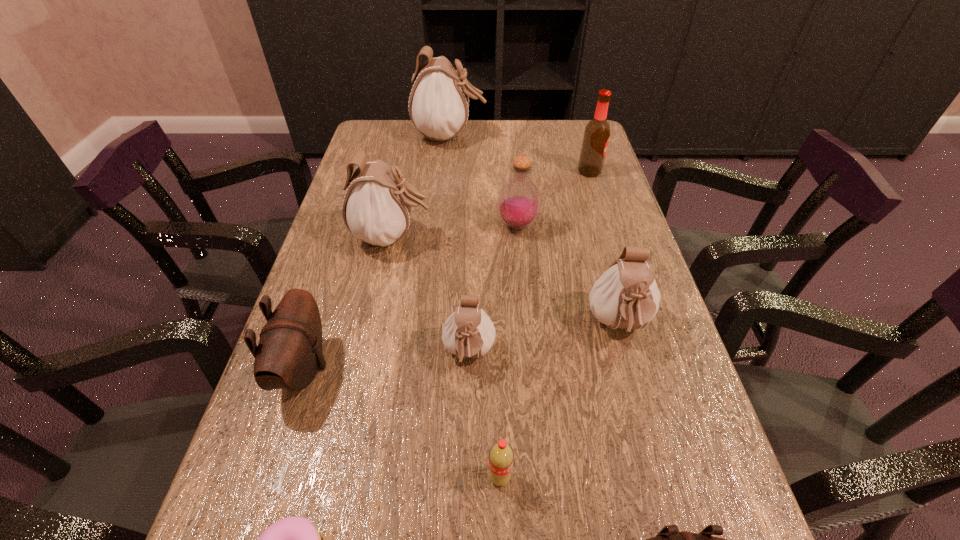
Identify which pouch is the third nearest to the smallest white pouch. Please provide its 2D coordinates. Your answer should be formatted as a tuple, i.e. [(x, y)], where the tuple contains the x and y coordinates of a point satisfying the conditions above.

[(289, 353)]

Identify which white pouch is located as the third nearest to the smallest white pouch. Please provide its 2D coordinates. Your answer should be formatted as a tuple, i.e. [(x, y)], where the tuple contains the x and y coordinates of a point satisfying the conditions above.

[(438, 106)]

Select which white pouch appears as the second closest to the fifth nearest pouch. Please provide its 2D coordinates. Your answer should be formatted as a tuple, i.e. [(x, y)], where the tuple contains the x and y coordinates of a point satisfying the conditions above.

[(438, 106)]

At what (x,y) coordinates should I click in order to perform the action: click on vacant position in the image that satisfies the following two spatial constraints: 1. on the back side of the third nearest object; 2. on the front-facing side of the fifth shortest pouch. Please return your answer as a coordinate pair (x, y). Looking at the image, I should click on (492, 237).

I want to click on free space that satisfies the following two spatial constraints: 1. on the front-facing side of the smallest white pouch; 2. with the flap open on the bigger brown pouch, so click(x=468, y=368).